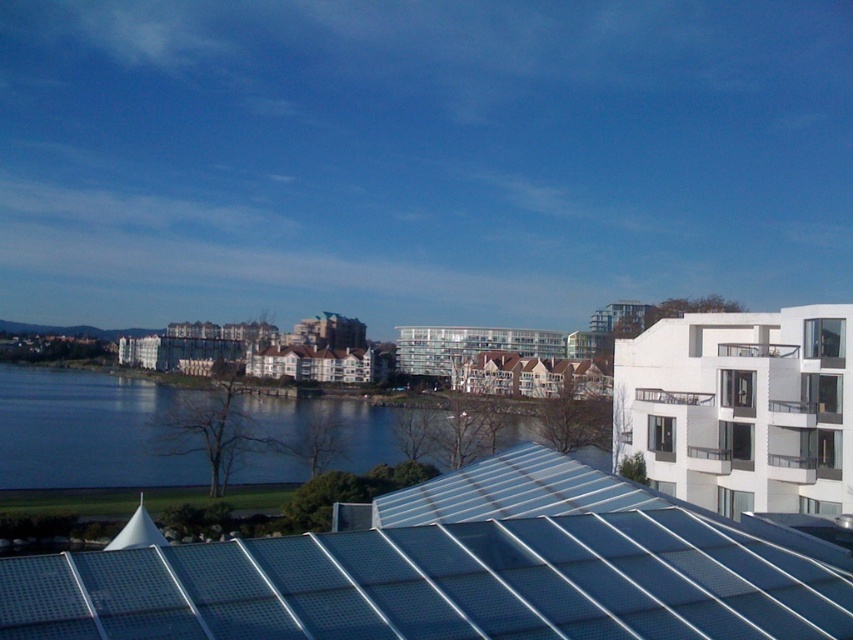
Measure the distance between metallic silver roof at center and white glass balcony at upper right.

A distance of 20.32 meters exists between metallic silver roof at center and white glass balcony at upper right.

Based on the photo, who is shorter, metallic silver roof at center or white glass balcony at upper right?

Standing shorter between the two is white glass balcony at upper right.

What do you see at coordinates (457, 572) in the screenshot? The height and width of the screenshot is (640, 853). I see `metallic silver roof at center` at bounding box center [457, 572].

Identify the location of metallic silver roof at center. (457, 572).

Between blue water at center and white glass balcony at upper right, which one has less height?

With less height is white glass balcony at upper right.

Does blue water at center come in front of white glass balcony at upper right?

No, it is behind white glass balcony at upper right.

Where is `blue water at center`? The width and height of the screenshot is (853, 640). blue water at center is located at coordinates (90, 429).

Consider the image. Which is below, metallic silver roof at center or blue water at center?

blue water at center

Between metallic silver roof at center and blue water at center, which one appears on the right side from the viewer's perspective?

From the viewer's perspective, metallic silver roof at center appears more on the right side.

Is point (757, 540) positioned in front of point (48, 413)?

That is True.

The height and width of the screenshot is (640, 853). I want to click on metallic silver roof at center, so click(x=457, y=572).